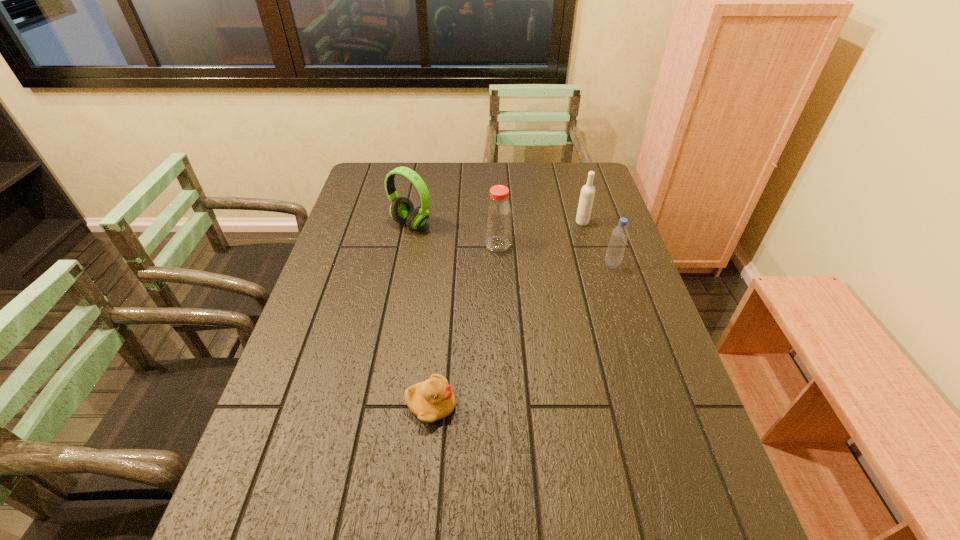
Locate an element on the screen. The width and height of the screenshot is (960, 540). free location located 0.050m on the back of the second object from right to left is located at coordinates (579, 210).

Where is `free spot located 0.190m on the front of the right bottle`? Image resolution: width=960 pixels, height=540 pixels. free spot located 0.190m on the front of the right bottle is located at coordinates (630, 318).

At what (x,y) coordinates should I click in order to perform the action: click on vacant space located 0.320m on the front-facing side of the duckling. Please return your answer as a coordinate pair (x, y). Looking at the image, I should click on (601, 405).

Identify the location of object that is at the left edge. This screenshot has width=960, height=540. (402, 210).

Where is `vodka present at the right edge`? vodka present at the right edge is located at coordinates (587, 194).

Find the location of `bottle situated at the right edge`. bottle situated at the right edge is located at coordinates (619, 236).

In the image, there is a desktop. Where is `vacant area at the far edge`? This screenshot has width=960, height=540. vacant area at the far edge is located at coordinates (404, 188).

In the image, there is a desktop. Where is `vacant space at the left edge`? The image size is (960, 540). vacant space at the left edge is located at coordinates (377, 247).

Identify the location of vacant space at the right edge. (620, 270).

Locate an element on the screen. The image size is (960, 540). vacant region at the far left corner is located at coordinates (395, 178).